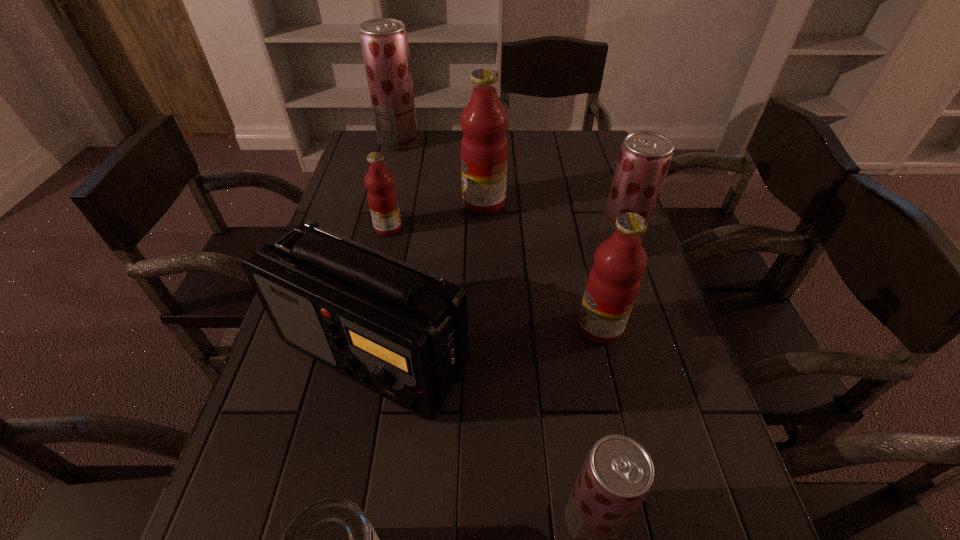
The height and width of the screenshot is (540, 960). In order to click on vacant space positioned on the label of the leftmost pink fruit juice in this screenshot , I will do `click(485, 228)`.

Identify the location of object present at the far edge. The width and height of the screenshot is (960, 540). (384, 42).

Find the location of a particular element. The width and height of the screenshot is (960, 540). radio receiver located in the left edge section of the desktop is located at coordinates pyautogui.click(x=400, y=331).

Identify the location of object that is at the far left corner. The width and height of the screenshot is (960, 540). (384, 42).

Find the location of a particular element. The image size is (960, 540). free space at the far edge of the desktop is located at coordinates (523, 147).

Find the location of a particular element. The image size is (960, 540). vacant space at the left edge of the desktop is located at coordinates (348, 169).

In the image, there is a desktop. Where is `vacant space at the right edge`? vacant space at the right edge is located at coordinates (662, 524).

Find the location of a particular element. vacant area at the far left corner of the desktop is located at coordinates (397, 160).

Where is `free space at the far right corner`? The image size is (960, 540). free space at the far right corner is located at coordinates (577, 146).

Identify the location of vacant area that lies between the radio receiver and the rightmost pink fruit juice. (487, 341).